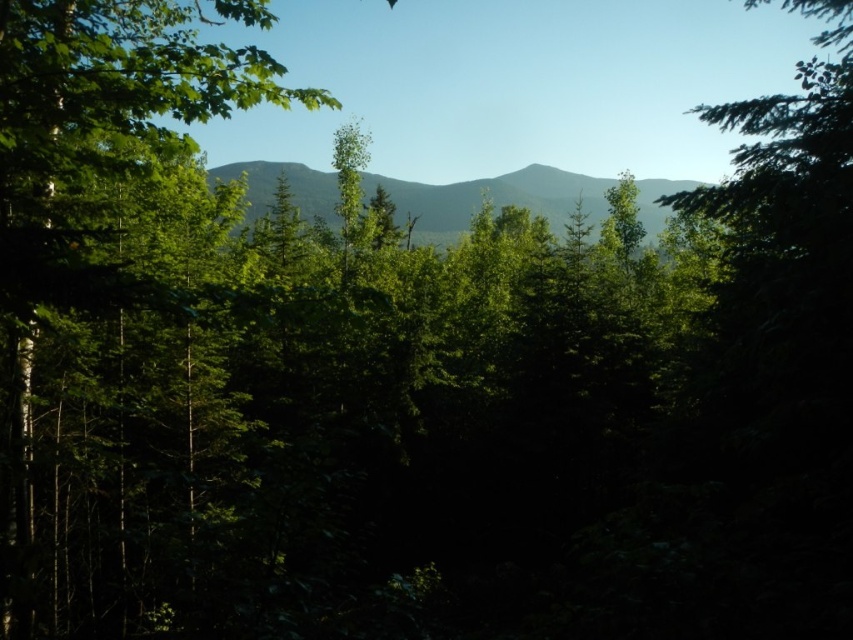
Does green leafy tree at left have a lesser height compared to green textured mountain at center?

No.

Is point (119, 61) farther from viewer compared to point (498, 179)?

No, (119, 61) is in front of (498, 179).

Which is in front, point (85, 307) or point (556, 179)?

Positioned in front is point (85, 307).

Identify the location of green leafy tree at left. (94, 134).